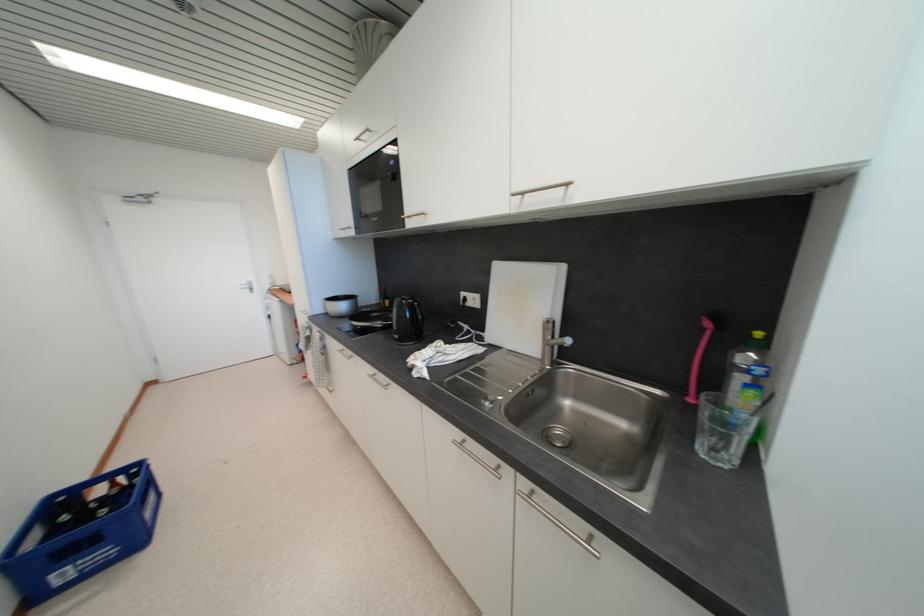
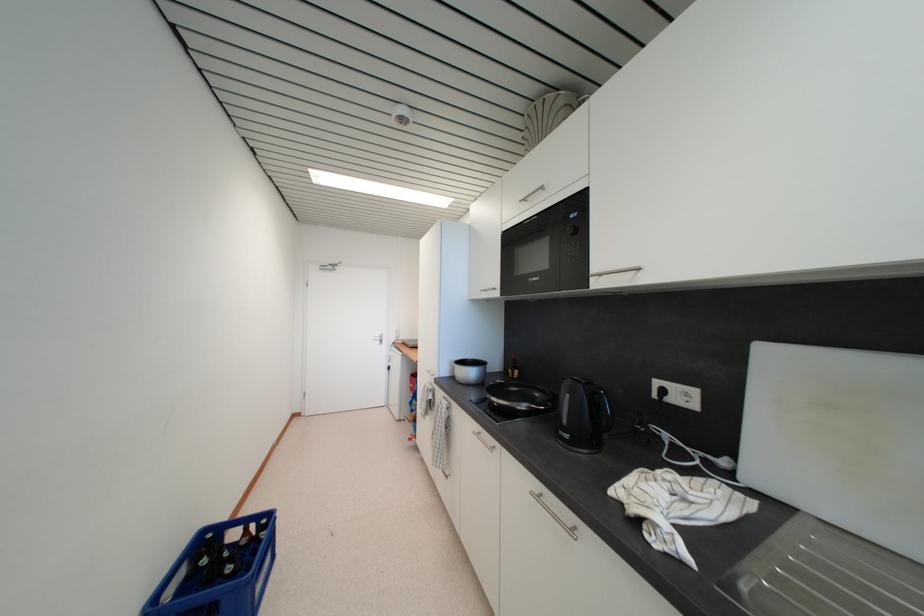
Question: The camera is either moving clockwise (left) or counter-clockwise (right) around the object. The first image is from the beginning of the video and the second image is from the end. Is the camera moving left or right when shooting the video?

Choices:
 (A) Left
 (B) Right

Answer: (B)